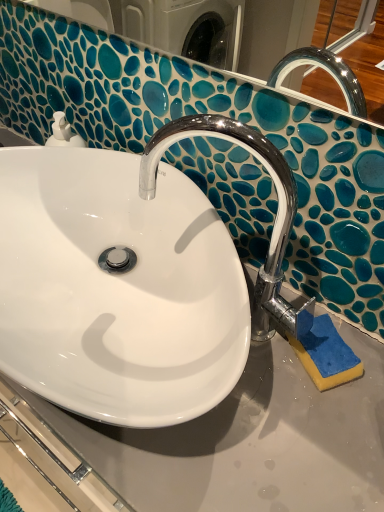
Where is `free space in front of blue sponge at lower right`? This screenshot has height=512, width=384. free space in front of blue sponge at lower right is located at coordinates (312, 438).